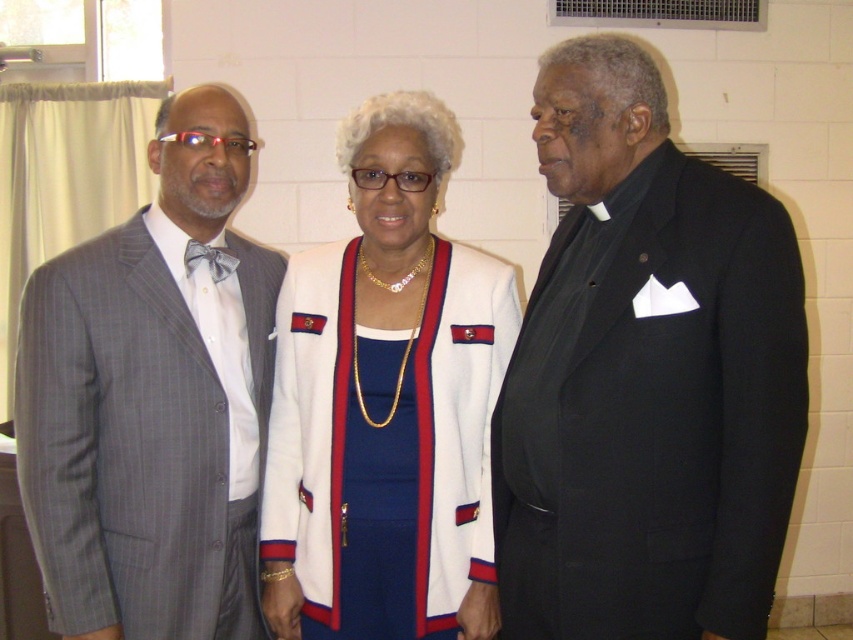
Between point (204, 406) and point (376, 99), which one is positioned behind?

Positioned behind is point (376, 99).

In the scene shown: Who is more forward, (236, 193) or (318, 609)?

Positioned in front is point (318, 609).

Locate an element on the screen. This screenshot has height=640, width=853. gray pinstripe suit at left is located at coordinates (154, 400).

Which is below, black satin suit at right or white fabric jacket at center?

white fabric jacket at center is lower down.

Does black satin suit at right have a smaller size compared to white fabric jacket at center?

Incorrect, black satin suit at right is not smaller in size than white fabric jacket at center.

Is point (677, 304) less distant than point (383, 616)?

Yes.

Find the location of `black satin suit at right`. black satin suit at right is located at coordinates (x=646, y=378).

Is black satin suit at right shorter than gray pinstripe suit at left?

Correct, black satin suit at right is not as tall as gray pinstripe suit at left.

Which is in front, point (711, 397) or point (141, 624)?

Point (711, 397) is in front.

Identify the location of black satin suit at right. (646, 378).

Where is `black satin suit at right`? The image size is (853, 640). black satin suit at right is located at coordinates (646, 378).